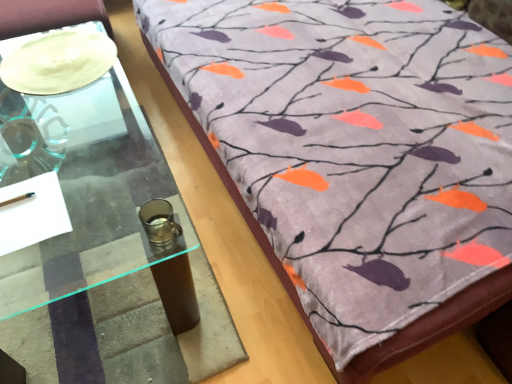
Describe the element at coordinates (356, 157) in the screenshot. This screenshot has height=384, width=512. I see `velvet fabric bedspread at upper right` at that location.

Identify the location of white matte plate at upper left. (58, 62).

Find the location of `velvet fabric bedspread at upper right`. velvet fabric bedspread at upper right is located at coordinates (356, 157).

Which point is more forward, (122,235) or (155,38)?

The point (122,235) is closer to the camera.

Is clear glass table at left positioned with its back to velvet fabric bedspread at upper right?

Yes.

Which of these two, clear glass table at left or velvet fabric bedspread at upper right, is bigger?

velvet fabric bedspread at upper right.

How distant is clear glass table at left from velvet fabric bedspread at upper right?

clear glass table at left is 67.51 centimeters away from velvet fabric bedspread at upper right.

Is point (428, 247) positioned in front of point (69, 48)?

That is True.

Considering the relative sizes of velvet fabric bedspread at upper right and white matte plate at upper left in the image provided, is velvet fabric bedspread at upper right shorter than white matte plate at upper left?

No.

Could white matte plate at upper left be considered to be inside velvet fabric bedspread at upper right?

No, white matte plate at upper left is not inside velvet fabric bedspread at upper right.

Is velvet fabric bedspread at upper right thinner than white matte plate at upper left?

Incorrect, the width of velvet fabric bedspread at upper right is not less than that of white matte plate at upper left.

From their relative heights in the image, would you say clear glass table at left is taller or shorter than white matte plate at upper left?

In the image, clear glass table at left appears to be taller than white matte plate at upper left.

Is clear glass table at left further to the viewer compared to white matte plate at upper left?

That is False.

Is white matte plate at upper left completely or partially inside clear glass table at left?

Definitely not — white matte plate at upper left is not inside clear glass table at left.

From the image's perspective, relative to clear glass table at left, is velvet fabric bedspread at upper right above or below?

Based on their image positions, velvet fabric bedspread at upper right is located above clear glass table at left.

From a real-world perspective, is velvet fabric bedspread at upper right under clear glass table at left?

Indeed, from a real-world perspective, velvet fabric bedspread at upper right is positioned beneath clear glass table at left.

In the scene shown: Can you confirm if velvet fabric bedspread at upper right is smaller than clear glass table at left?

No, velvet fabric bedspread at upper right is not smaller than clear glass table at left.

Is white matte plate at upper left turned away from velvet fabric bedspread at upper right?

No, white matte plate at upper left is not facing the opposite direction of velvet fabric bedspread at upper right.

Based on the photo, from the image's perspective, does white matte plate at upper left appear higher than velvet fabric bedspread at upper right?

Yes, from the image's perspective, white matte plate at upper left is above velvet fabric bedspread at upper right.

From a real-world perspective, is white matte plate at upper left beneath velvet fabric bedspread at upper right?

No, from a real-world perspective, white matte plate at upper left is not under velvet fabric bedspread at upper right.

Is white matte plate at upper left inside the boundaries of velvet fabric bedspread at upper right, or outside?

white matte plate at upper left cannot be found inside velvet fabric bedspread at upper right.

Which object is further away from the camera, white matte plate at upper left or clear glass table at left?

white matte plate at upper left is further away from the camera.

Which object is wider, white matte plate at upper left or clear glass table at left?

clear glass table at left is wider.

In the scene shown: Is white matte plate at upper left not close to clear glass table at left?

No, white matte plate at upper left is not far away from clear glass table at left.

I want to click on furniture above the clear glass table at left (from the image's perspective), so click(x=356, y=157).

Identify the location of furniture directly beneath the white matte plate at upper left (from a real-world perspective). (356, 157).

Which object lies nearer to the anchor point velvet fabric bedspread at upper right, white matte plate at upper left or clear glass table at left?

clear glass table at left is closer to velvet fabric bedspread at upper right.

Looking at the image, which one is located closer to clear glass table at left, velvet fabric bedspread at upper right or white matte plate at upper left?

white matte plate at upper left is positioned closer to the anchor clear glass table at left.

Looking at the image, which one is located closer to clear glass table at left, white matte plate at upper left or velvet fabric bedspread at upper right?

white matte plate at upper left lies closer to clear glass table at left than the other object.

Considering their positions, is clear glass table at left positioned further to white matte plate at upper left than velvet fabric bedspread at upper right?

velvet fabric bedspread at upper right is positioned further to the anchor white matte plate at upper left.

Estimate the real-world distances between objects in this image. Which object is further from velvet fabric bedspread at upper right, clear glass table at left or white matte plate at upper left?

white matte plate at upper left lies further to velvet fabric bedspread at upper right than the other object.

From the image, which object appears to be nearer to white matte plate at upper left, velvet fabric bedspread at upper right or clear glass table at left?

clear glass table at left is closer to white matte plate at upper left.

This screenshot has width=512, height=384. I want to click on furniture between white matte plate at upper left and clear glass table at left in the up-down direction, so click(x=356, y=157).